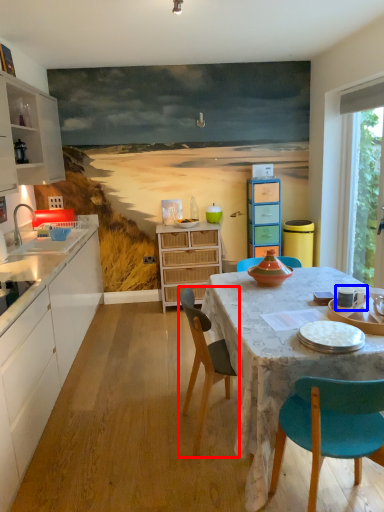
Question: Which object appears farthest to the camera in this image, chair (highlighted by a red box) or tableware (highlighted by a blue box)?

Choices:
 (A) chair
 (B) tableware

Answer: (B)